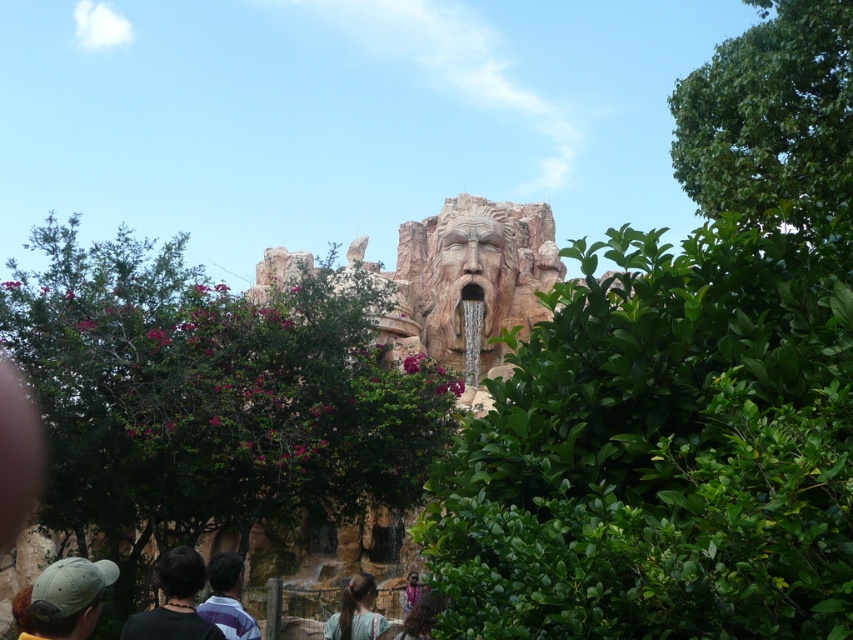
Question: Where is khaki fabric cap at lower left located in relation to black fabric at lower left in the image?

Choices:
 (A) below
 (B) above

Answer: (B)

Question: Is green leafy bush at center positioned in front of brown stone face at center?

Choices:
 (A) no
 (B) yes

Answer: (B)

Question: Observing the image, what is the correct spatial positioning of brown stone face at center in reference to black fabric at lower left?

Choices:
 (A) below
 (B) above

Answer: (B)

Question: Which of the following is the farthest from the observer?

Choices:
 (A) green leafy tree at center
 (B) brown hair at lower center

Answer: (A)

Question: Which of the following is the farthest from the observer?

Choices:
 (A) black fabric at lower left
 (B) brown stone face at center
 (C) khaki fabric cap at lower left

Answer: (B)

Question: Among these objects, which one is farthest from the camera?

Choices:
 (A) khaki fabric cap at lower left
 (B) brown hair at lower center
 (C) black fabric at lower left

Answer: (B)